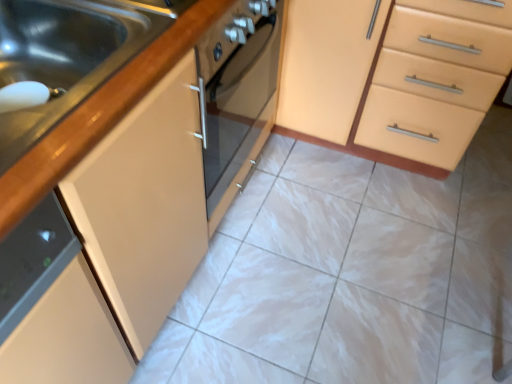
Describe the element at coordinates (394, 77) in the screenshot. I see `matte beige cabinet at center` at that location.

What are the coordinates of `matte beige cabinet at center` in the screenshot? It's located at (394, 77).

Measure the distance between brushed metal sink at left and camera.

brushed metal sink at left is 19.69 inches away from camera.

Describe the element at coordinates (99, 115) in the screenshot. I see `brushed metal sink at left` at that location.

At what (x,y) coordinates should I click in order to perform the action: click on brushed metal sink at left. Please return your answer as a coordinate pair (x, y). Looking at the image, I should click on (99, 115).

This screenshot has width=512, height=384. Find the location of `matte beige cabinet at center`. matte beige cabinet at center is located at coordinates (394, 77).

Which is more to the right, matte beige cabinet at center or brushed metal sink at left?

From the viewer's perspective, matte beige cabinet at center appears more on the right side.

Consider the image. Which object is further away from the camera taking this photo, matte beige cabinet at center or brushed metal sink at left?

matte beige cabinet at center.

Which point is more forward, [319,87] or [143,69]?

The point [143,69] is more forward.

From the image's perspective, which object appears higher, matte beige cabinet at center or brushed metal sink at left?

matte beige cabinet at center.

From a real-world perspective, is matte beige cabinet at center physically located above or below brushed metal sink at left?

In terms of real-world spatial position, matte beige cabinet at center is below brushed metal sink at left.

Considering the relative sizes of matte beige cabinet at center and brushed metal sink at left in the image provided, is matte beige cabinet at center wider than brushed metal sink at left?

Yes, matte beige cabinet at center is wider than brushed metal sink at left.

Who is taller, matte beige cabinet at center or brushed metal sink at left?

Standing taller between the two is matte beige cabinet at center.

Looking at this image, which of these two, matte beige cabinet at center or brushed metal sink at left, is bigger?

With larger size is matte beige cabinet at center.

Is matte beige cabinet at center surrounding brushed metal sink at left?

Definitely not — brushed metal sink at left is not inside matte beige cabinet at center.

Based on the photo, are matte beige cabinet at center and brushed metal sink at left beside each other?

No, matte beige cabinet at center is not next to brushed metal sink at left.

In the scene shown: Is matte beige cabinet at center oriented towards brushed metal sink at left?

Yes, matte beige cabinet at center is facing brushed metal sink at left.

How many degrees apart are the facing directions of matte beige cabinet at center and brushed metal sink at left?

There is a 89.1-degree angle between the facing directions of matte beige cabinet at center and brushed metal sink at left.

Locate an element on the screen. countertop lying on the left of matte beige cabinet at center is located at coordinates (99, 115).

Between brushed metal sink at left and matte beige cabinet at center, which one appears on the left side from the viewer's perspective?

From the viewer's perspective, brushed metal sink at left appears more on the left side.

Between brushed metal sink at left and matte beige cabinet at center, which one is positioned behind?

matte beige cabinet at center is behind.

Does point (22, 160) lie in front of point (356, 41)?

Yes, it is in front of point (356, 41).

From the image's perspective, does brushed metal sink at left appear lower than matte beige cabinet at center?

Correct, brushed metal sink at left appears lower than matte beige cabinet at center in the image.

From a real-world perspective, who is located higher, brushed metal sink at left or matte beige cabinet at center?

brushed metal sink at left is physically above.

Consider the image. Considering the relative sizes of brushed metal sink at left and matte beige cabinet at center in the image provided, is brushed metal sink at left thinner than matte beige cabinet at center?

Correct, the width of brushed metal sink at left is less than that of matte beige cabinet at center.

Is brushed metal sink at left taller than matte beige cabinet at center?

No, brushed metal sink at left is not taller than matte beige cabinet at center.

Can you confirm if brushed metal sink at left is smaller than matte beige cabinet at center?

Indeed, brushed metal sink at left has a smaller size compared to matte beige cabinet at center.

Consider the image. Which is correct: brushed metal sink at left is inside matte beige cabinet at center, or outside of it?

brushed metal sink at left is outside matte beige cabinet at center.

Is brushed metal sink at left far away from matte beige cabinet at center?

Actually, brushed metal sink at left and matte beige cabinet at center are a little close together.

Is brushed metal sink at left facing towards matte beige cabinet at center?

No, brushed metal sink at left does not turn towards matte beige cabinet at center.

At what (x,y) coordinates should I click in order to perform the action: click on cabinetry below the brushed metal sink at left (from a real-world perspective). Please return your answer as a coordinate pair (x, y). Looking at the image, I should click on (394, 77).

This screenshot has width=512, height=384. Find the location of `countertop lying in front of the matte beige cabinet at center`. countertop lying in front of the matte beige cabinet at center is located at coordinates (99, 115).

Where is `countertop above the matte beige cabinet at center (from a real-world perspective)`? countertop above the matte beige cabinet at center (from a real-world perspective) is located at coordinates (99, 115).